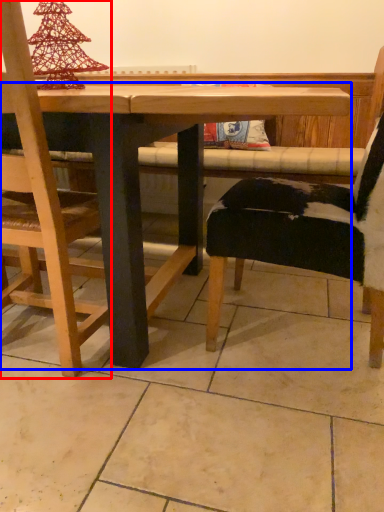
Question: Among these objects, which one is nearest to the camera, chair (highlighted by a red box) or table (highlighted by a blue box)?

Choices:
 (A) chair
 (B) table

Answer: (B)